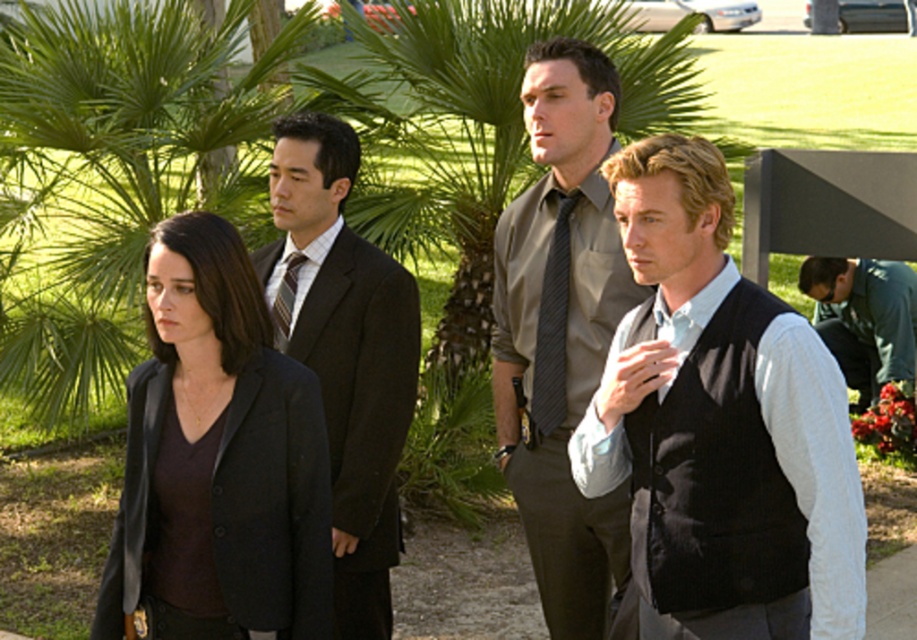
Question: Which object is positioned closest to the dark green shirt at lower right?

Choices:
 (A) black textured vest at center
 (B) matte gray shirt at center
 (C) dark brown suit at center

Answer: (B)

Question: Does matte black blazer at center have a greater width compared to matte gray shirt at center?

Choices:
 (A) yes
 (B) no

Answer: (A)

Question: Which of the following is the farthest from the observer?

Choices:
 (A) black textured vest at center
 (B) dark green shirt at lower right
 (C) dark gray striped tie at center
 (D) matte gray shirt at center

Answer: (B)

Question: Which point appears closest to the camera in this image?

Choices:
 (A) (210, 285)
 (B) (753, 532)

Answer: (B)

Question: Is matte gray shirt at center thinner than dark brown suit at center?

Choices:
 (A) no
 (B) yes

Answer: (B)

Question: Considering the relative positions of matte black blazer at center and dark gray striped tie at center in the image provided, where is matte black blazer at center located with respect to dark gray striped tie at center?

Choices:
 (A) above
 (B) below

Answer: (B)